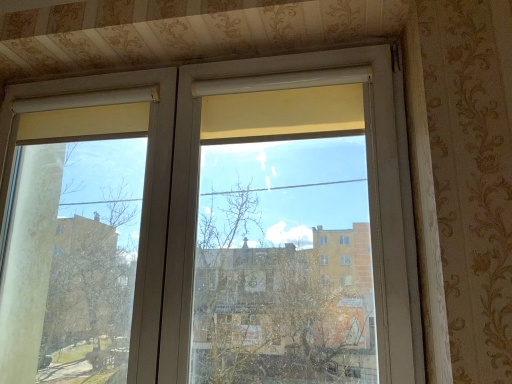
Question: Can you confirm if transparent glass window at center is taller than white matte screen door at upper center?

Choices:
 (A) yes
 (B) no

Answer: (A)

Question: Is transparent glass window at center beside white matte screen door at upper center?

Choices:
 (A) yes
 (B) no

Answer: (B)

Question: Could white matte screen door at upper center be considered to be inside transparent glass window at center?

Choices:
 (A) no
 (B) yes

Answer: (B)

Question: Is transparent glass window at center thinner than white matte screen door at upper center?

Choices:
 (A) yes
 (B) no

Answer: (A)

Question: From a real-world perspective, is transparent glass window at center under white matte screen door at upper center?

Choices:
 (A) yes
 (B) no

Answer: (B)

Question: Is transparent glass window at center oriented towards white matte screen door at upper center?

Choices:
 (A) no
 (B) yes

Answer: (B)

Question: Is transparent glass window at center inside white matte screen door at upper center?

Choices:
 (A) yes
 (B) no

Answer: (A)

Question: Is white matte screen door at upper center placed right next to transparent glass window at center?

Choices:
 (A) no
 (B) yes

Answer: (A)

Question: Is white matte screen door at upper center aimed at transparent glass window at center?

Choices:
 (A) yes
 (B) no

Answer: (A)

Question: From the image's perspective, is white matte screen door at upper center under transparent glass window at center?

Choices:
 (A) no
 (B) yes

Answer: (B)

Question: Does white matte screen door at upper center have a greater height compared to transparent glass window at center?

Choices:
 (A) no
 (B) yes

Answer: (A)

Question: Is white matte screen door at upper center further to the viewer compared to transparent glass window at center?

Choices:
 (A) no
 (B) yes

Answer: (B)

Question: Visually, is white matte screen door at upper center positioned to the left or to the right of transparent glass window at center?

Choices:
 (A) right
 (B) left

Answer: (B)